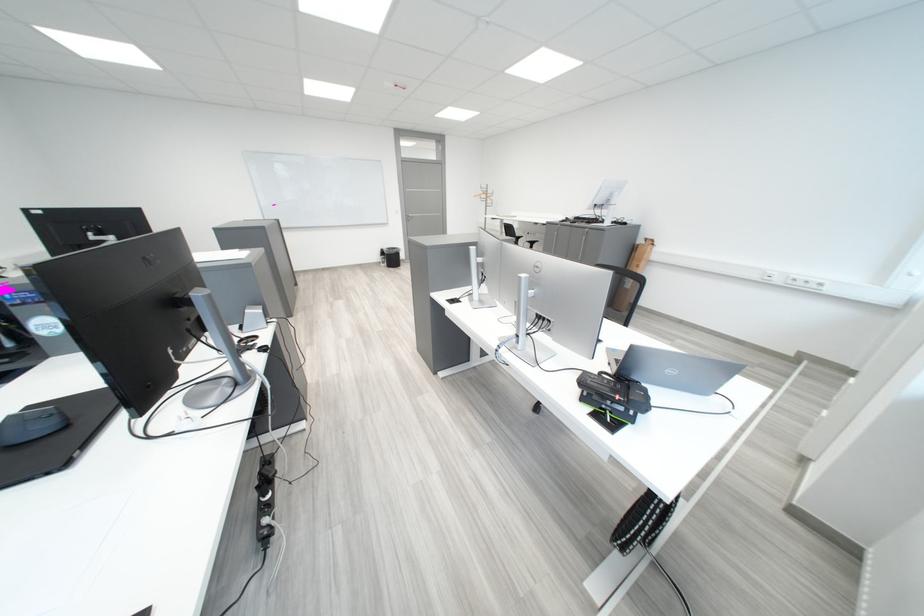
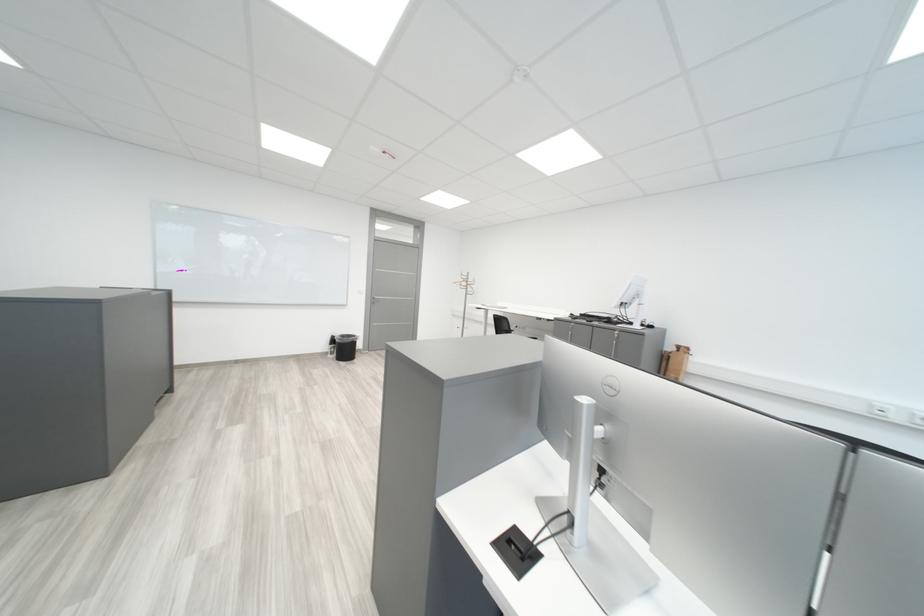
Question: Which direction would the cameraman need to move to produce the second image? Reply with the corresponding letter.

Choices:
 (A) Left
 (B) Right
 (C) Forward
 (D) Backward

Answer: (C)